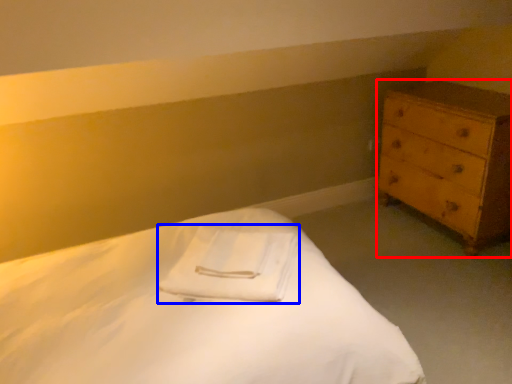
Question: Among these objects, which one is nearest to the camera, chest of drawers (highlighted by a red box) or cloth (highlighted by a blue box)?

Choices:
 (A) chest of drawers
 (B) cloth

Answer: (B)